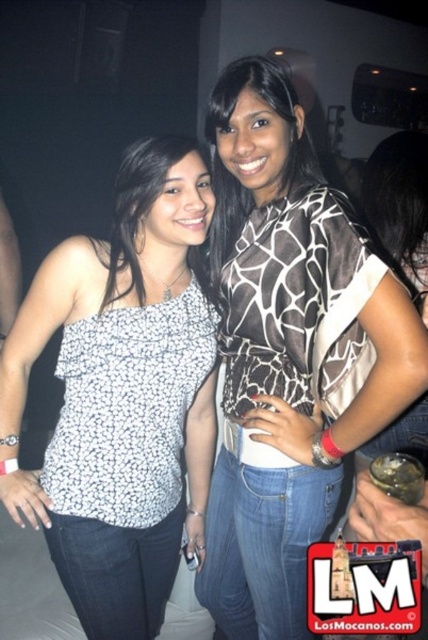
The height and width of the screenshot is (640, 428). Identify the location of giraffe-patterned top at center. [291, 353].

What are the coordinates of `giraffe-patterned top at center` in the screenshot? It's located at (291, 353).